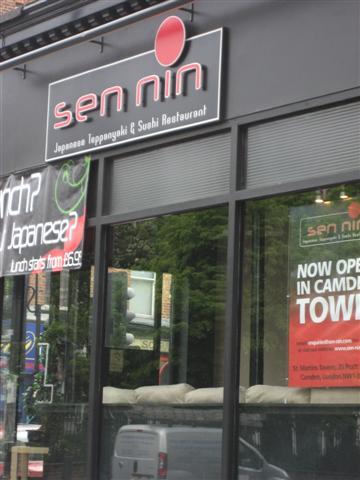
This screenshot has height=480, width=360. Find the location of `pillow`. pillow is located at coordinates (126, 401), (160, 396), (204, 393), (268, 406), (337, 402).